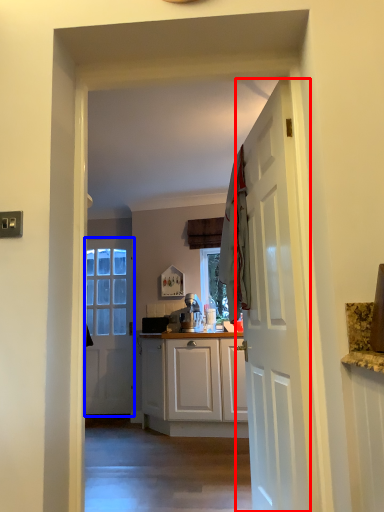
Question: Among these objects, which one is nearest to the camera, door (highlighted by a red box) or door (highlighted by a blue box)?

Choices:
 (A) door
 (B) door

Answer: (A)